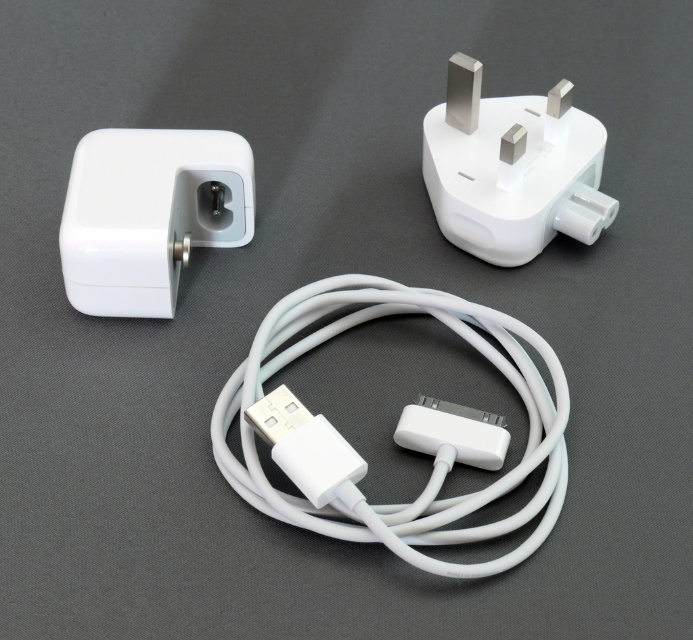
Question: Which of these objects is positioned farthest from the white plastic plug at upper right?

Choices:
 (A) white matte cable at center
 (B) white matte power adapter at upper left

Answer: (B)

Question: Is white matte cable at center to the right of white matte power adapter at upper left from the viewer's perspective?

Choices:
 (A) yes
 (B) no

Answer: (A)

Question: Is the position of white matte cable at center less distant than that of white matte power adapter at upper left?

Choices:
 (A) no
 (B) yes

Answer: (B)

Question: Among these objects, which one is farthest from the camera?

Choices:
 (A) white matte cable at center
 (B) white matte power adapter at upper left

Answer: (B)

Question: Where is white matte power adapter at upper left located in relation to white plastic plug at upper right in the image?

Choices:
 (A) right
 (B) left

Answer: (B)

Question: Which object appears farthest from the camera in this image?

Choices:
 (A) white plastic plug at upper right
 (B) white matte power adapter at upper left
 (C) white matte cable at center

Answer: (A)